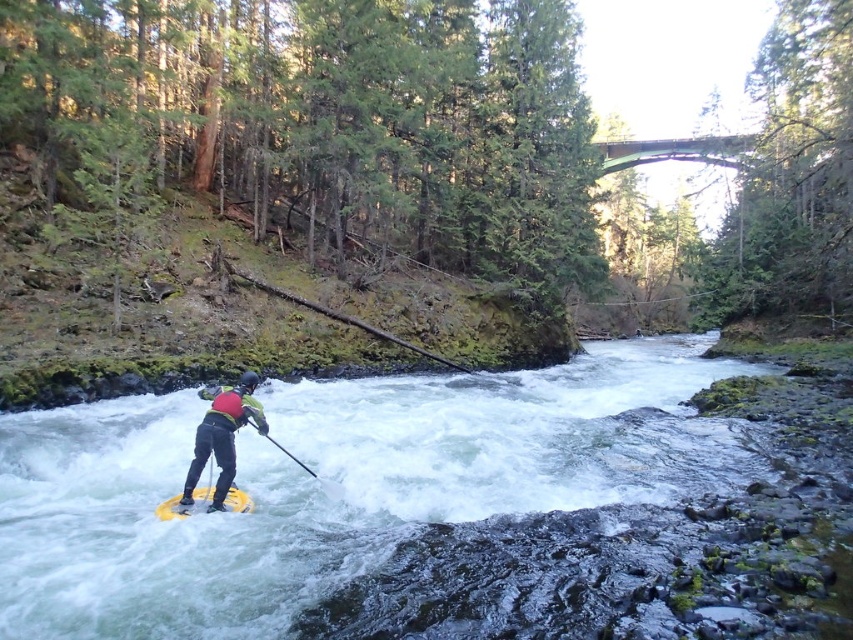
Identify the location of yellow rubber paddleboard at center. Image resolution: width=853 pixels, height=640 pixels. (376, 504).

Does yellow rubber paddleboard at center have a larger size compared to yellow rubber canoe at center?

Yes, yellow rubber paddleboard at center is bigger than yellow rubber canoe at center.

Find the location of `yellow rubber paddleboard at center`. yellow rubber paddleboard at center is located at coordinates pyautogui.click(x=376, y=504).

Is yellow foam paddleboard at center shorter than yellow foam paddle at center?

In fact, yellow foam paddleboard at center may be taller than yellow foam paddle at center.

Identify the location of yellow foam paddleboard at center. point(222,435).

Identify the location of yellow foam paddleboard at center. (222, 435).

Can you confirm if yellow rubber paddleboard at center is bigger than yellow foam paddleboard at center?

Correct, yellow rubber paddleboard at center is larger in size than yellow foam paddleboard at center.

Is point (674, 566) closer to camera compared to point (245, 387)?

Yes, point (674, 566) is closer to viewer.

At what (x,y) coordinates should I click in order to perform the action: click on yellow rubber paddleboard at center. Please return your answer as a coordinate pair (x, y). The image size is (853, 640). Looking at the image, I should click on (376, 504).